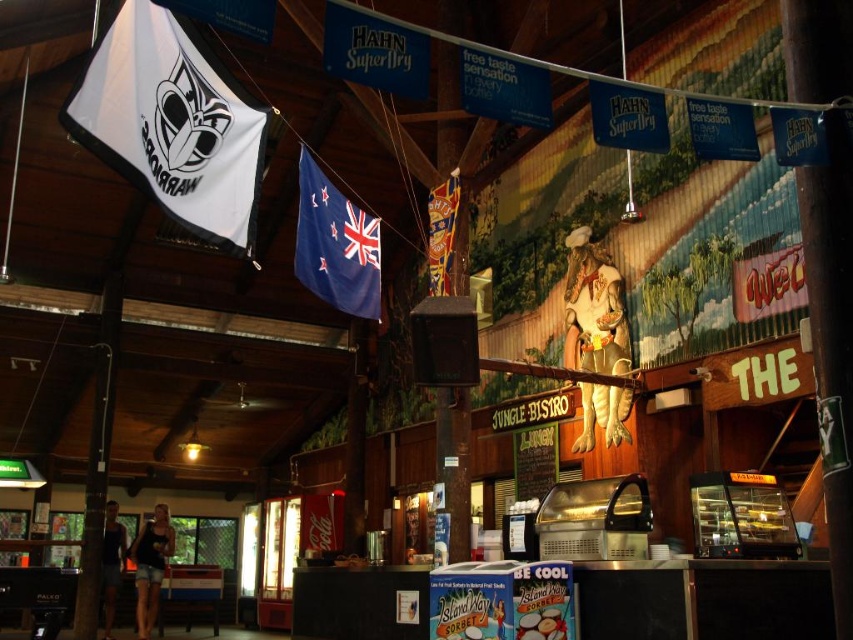
Question: Which of the following is the closest to the observer?

Choices:
 (A) (347, 268)
 (B) (219, 140)

Answer: (B)

Question: Which point is closer to the camera taking this photo?

Choices:
 (A) (354, 243)
 (B) (73, 109)

Answer: (B)

Question: Is white fabric flag at upper left below blue fabric flag at upper center?

Choices:
 (A) no
 (B) yes

Answer: (A)

Question: Which is nearer to the blue fabric flag at center?

Choices:
 (A) white fabric flag at upper left
 (B) blue fabric flag at upper center

Answer: (B)

Question: Does blue fabric flag at upper center have a larger size compared to blue fabric flag at center?

Choices:
 (A) yes
 (B) no

Answer: (A)

Question: Considering the relative positions of white fabric flag at upper left and blue fabric flag at upper center in the image provided, where is white fabric flag at upper left located with respect to blue fabric flag at upper center?

Choices:
 (A) left
 (B) right

Answer: (A)